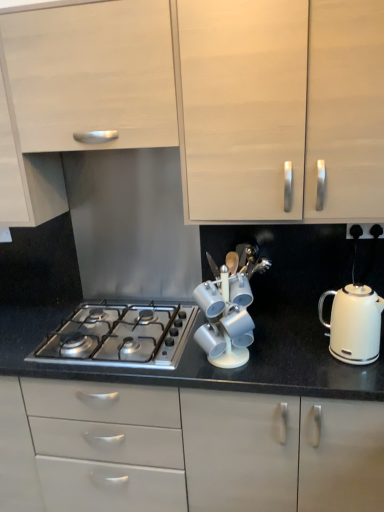
What are the coordinates of `vacant area on the back side of white glossy kettle at right` in the screenshot? It's located at (307, 329).